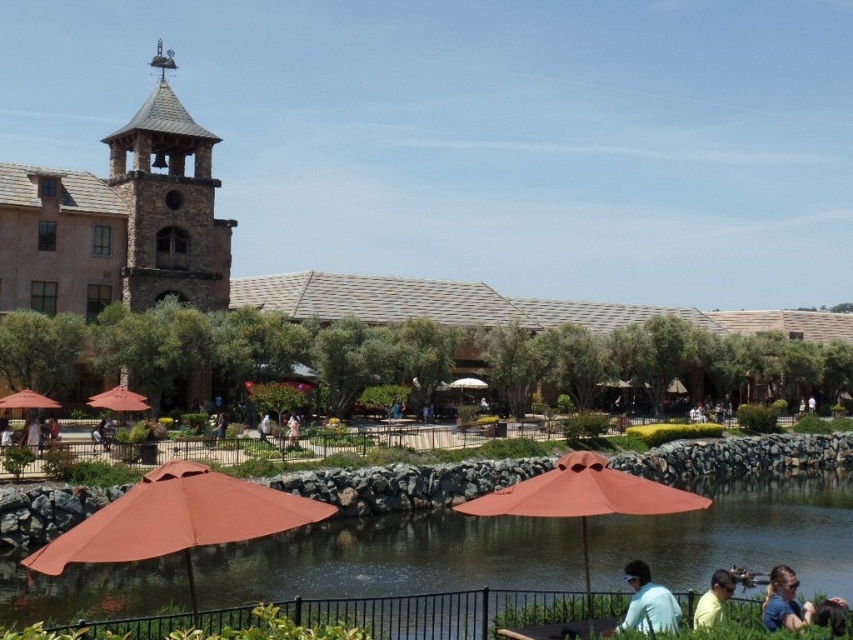
Does yellow matte shirt at lower right have a greater height compared to white fabric dress at center?

Yes.

Is yellow matte shirt at lower right thinner than white fabric dress at center?

In fact, yellow matte shirt at lower right might be wider than white fabric dress at center.

At what (x,y) coordinates should I click in order to perform the action: click on yellow matte shirt at lower right. Please return your answer as a coordinate pair (x, y). Looking at the image, I should click on (712, 600).

Measure the distance between brown fabric umbrella at lower left and camera.

The distance of brown fabric umbrella at lower left from camera is 31.46 meters.

Which is behind, point (83, 536) or point (109, 404)?

The point (109, 404) is more distant.

Identify the location of brown fabric umbrella at lower left. The image size is (853, 640). (177, 518).

Is point (102, 403) farther from viewer compared to point (294, 445)?

That is False.

Is matte orange umbrella at center shorter than white fabric dress at center?

No.

Who is more distant from viewer, (135, 396) or (289, 429)?

Positioned behind is point (289, 429).

This screenshot has width=853, height=640. In order to click on matte orange umbrella at center in this screenshot , I will do pos(119,401).